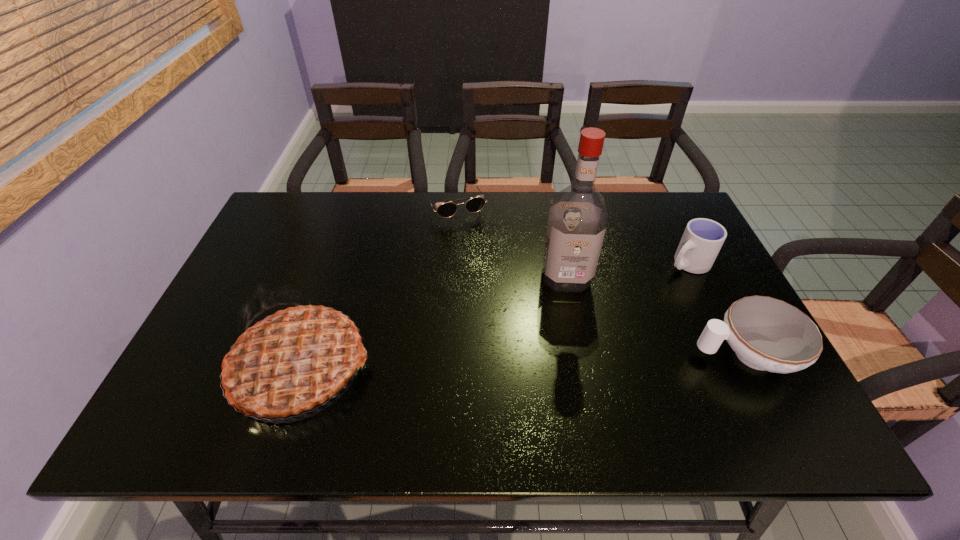
This screenshot has width=960, height=540. I want to click on vacant space situated on the side with the handle of the fourth tallest object, so click(581, 354).

Identify the location of vacant area situated on the side with the handle of the fourth tallest object. This screenshot has height=540, width=960. (585, 354).

At what (x,y) coordinates should I click in order to perform the action: click on vacant point located on the front-facing side of the third object from left to right. Please return your answer as a coordinate pair (x, y). Image resolution: width=960 pixels, height=540 pixels. Looking at the image, I should click on (571, 318).

At what (x,y) coordinates should I click in order to perform the action: click on free space located on the front-facing side of the third object from left to right. Please return your answer as a coordinate pair (x, y). This screenshot has height=540, width=960. Looking at the image, I should click on (572, 324).

I want to click on vacant region located 0.210m on the front-facing side of the third object from left to right, so click(577, 361).

Locate an element on the screen. This screenshot has height=540, width=960. free space located 0.340m with the handle on the side of the cup is located at coordinates (577, 321).

Image resolution: width=960 pixels, height=540 pixels. In order to click on vacant space situated 0.180m with the handle on the side of the cup in this screenshot , I will do `click(624, 295)`.

Image resolution: width=960 pixels, height=540 pixels. I want to click on free space located 0.190m with the handle on the side of the cup, so click(x=621, y=297).

Where is `blank area located 0.170m on the front lenses of the sunglasses`? The image size is (960, 540). blank area located 0.170m on the front lenses of the sunglasses is located at coordinates (481, 261).

You are a GUI agent. You are given a task and a screenshot of the screen. Output one action in this format:
    pyautogui.click(x=<x>, y=<y>)
    Task: Click on the vacant space located 0.330m on the front lenses of the sunglasses
    
    Given the screenshot: What is the action you would take?
    pyautogui.click(x=500, y=301)